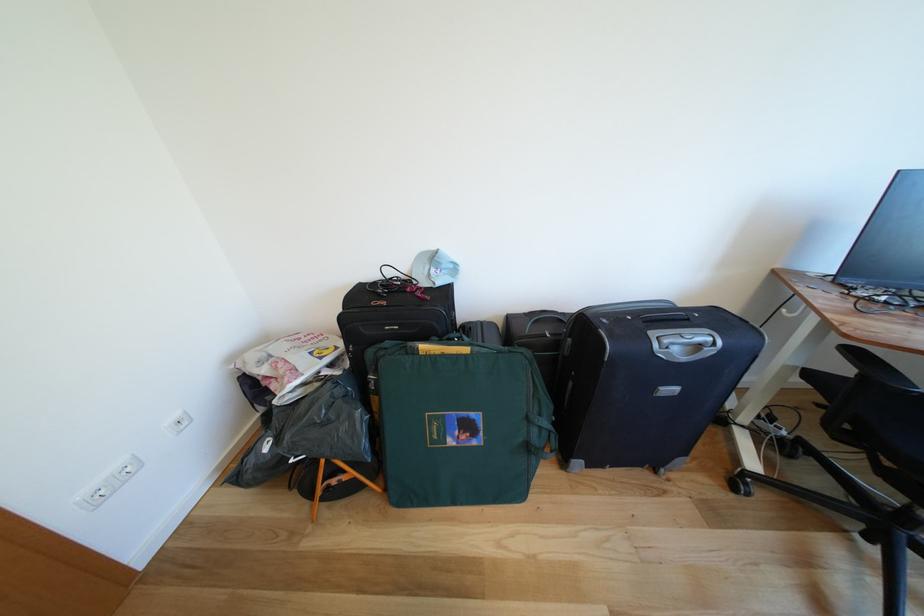
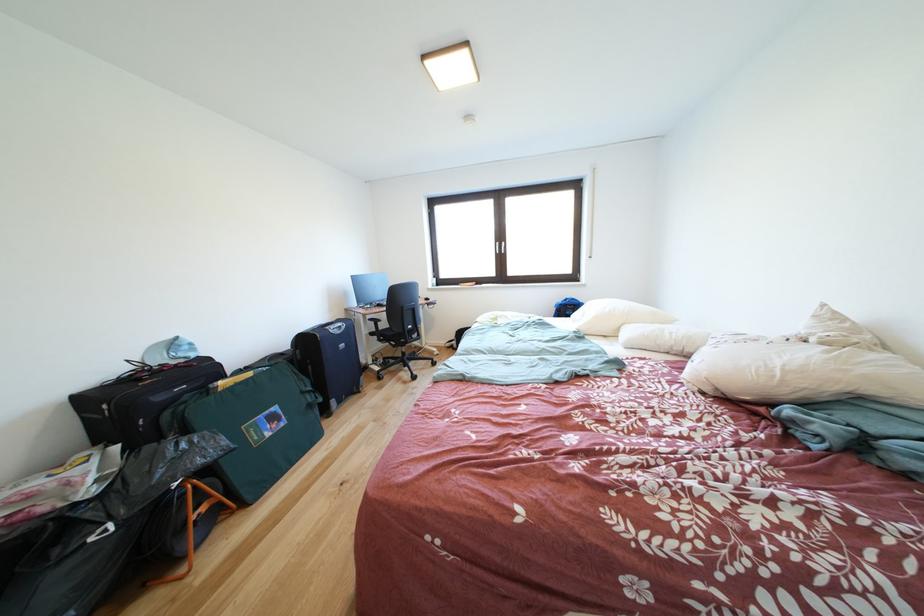
Where in the second image is the point corresponding to (x=432, y=304) from the first image?

(200, 371)